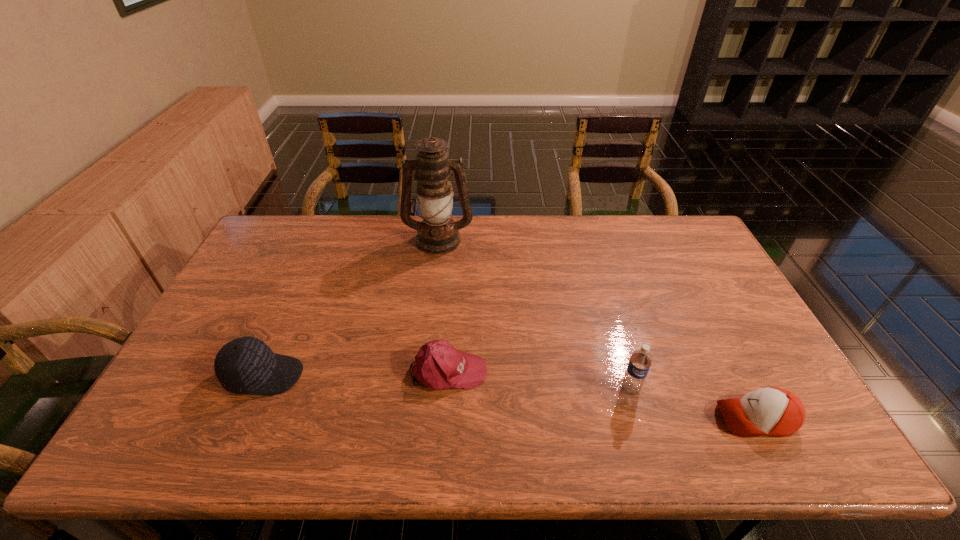
Locate an element on the screen. The width and height of the screenshot is (960, 540). the tallest object is located at coordinates (437, 234).

You are a GUI agent. You are given a task and a screenshot of the screen. Output one action in this format:
    pyautogui.click(x=<x>, y=<y>)
    Task: Click on the farthest object
    This screenshot has height=540, width=960.
    Given the screenshot: What is the action you would take?
    pyautogui.click(x=437, y=234)

Locate an element on the screen. water bottle is located at coordinates (640, 362).

This screenshot has width=960, height=540. What are the coordinates of `the second tallest object` in the screenshot? It's located at (640, 362).

The width and height of the screenshot is (960, 540). I want to click on the leftmost baseball cap, so click(246, 365).

This screenshot has height=540, width=960. I want to click on the tallest baseball cap, so click(x=246, y=365).

The image size is (960, 540). Identify the location of the rightmost object. (774, 411).

This screenshot has height=540, width=960. Identify the location of the nearest baseball cap. (774, 411).

The width and height of the screenshot is (960, 540). Find the location of `the second baseball cap from right to left`. the second baseball cap from right to left is located at coordinates (438, 365).

At what (x,y) coordinates should I click in order to perform the action: click on blank space located on the front of the farthest object. Please return your answer as a coordinate pair (x, y). Looking at the image, I should click on (428, 332).